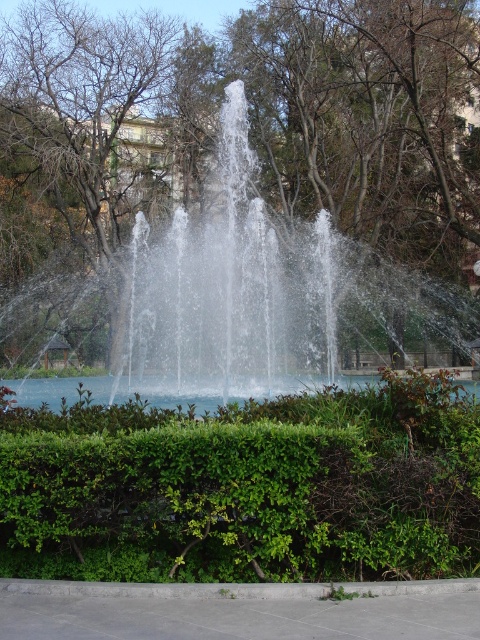
Question: Can you confirm if green leafy hedge at center is thinner than clear water fountain at center?

Choices:
 (A) yes
 (B) no

Answer: (A)

Question: Which object appears closest to the camera in this image?

Choices:
 (A) clear water at center
 (B) green leafy hedge at center

Answer: (B)

Question: Which of these objects is positioned farthest from the clear water fountain at center?

Choices:
 (A) green leafy hedge at center
 (B) clear water at center

Answer: (A)

Question: Which object is closer to the camera taking this photo?

Choices:
 (A) clear water fountain at center
 (B) clear water at center
 (C) green leafy hedge at center

Answer: (C)

Question: Is clear water fountain at center thinner than clear water at center?

Choices:
 (A) yes
 (B) no

Answer: (B)

Question: Is clear water fountain at center above clear water at center?

Choices:
 (A) no
 (B) yes

Answer: (B)